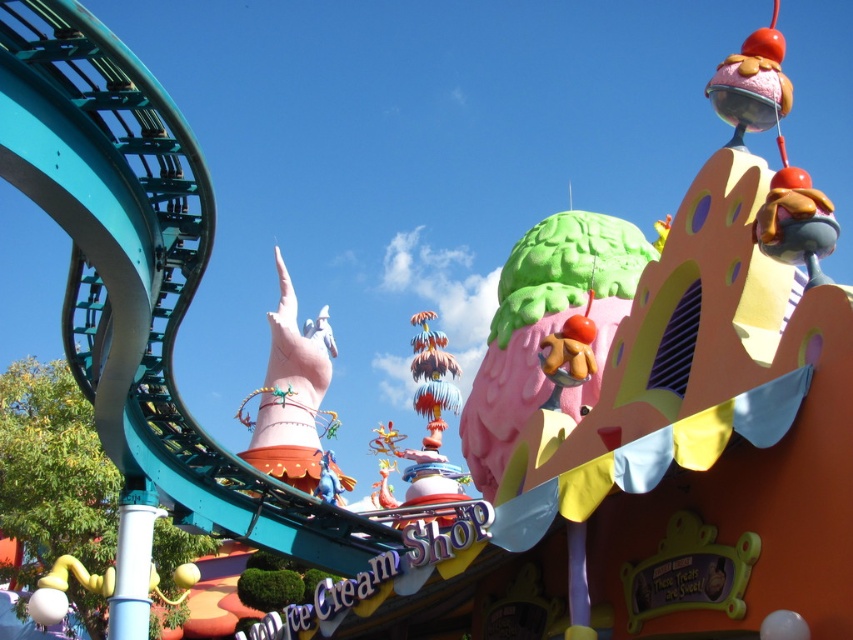
Based on the photo, you are a visitor at the theme park and see both the green matte ice cream cone at upper center and the pink matte hand at center. Which object is positioned to the right side from your perspective?

The green matte ice cream cone at upper center is positioned to the right of the pink matte hand at center.

You are a drone operator trying to deliver a small package from the green matte ice cream cone at upper center to the pink matte hand at center. Given that your drone can travel 50 meters before needing a battery recharge, will you be able to make the delivery without recharging?

The distance between the green matte ice cream cone at upper center and the pink matte hand at center is 48.98 meters, which is just under the drone travel limit of 50 meters. Therefore, the delivery can be made without needing a recharge.

You are a visitor at the theme park and see the green matte ice cream cone at upper center and the pink matte hand at center. Which object is larger?

The pink matte hand at center is larger than the green matte ice cream cone at upper center.